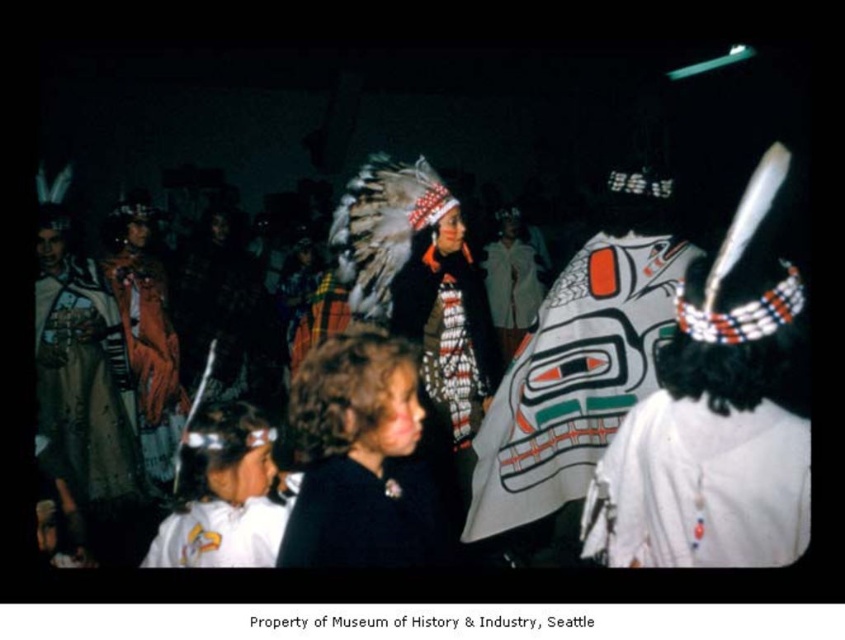
You are an attendee at the event and want to take a photo of both the dark brown hair at center and the white matte headdress at lower left. Which object should you focus on first if you want to capture both in the same frame without moving your camera?

The dark brown hair at center is larger in size than the white matte headdress at lower left, so you should focus on the dark brown hair at center first to ensure it fits properly in the frame before adjusting for the smaller white matte headdress at lower left.

You are standing in the middle of the event and want to move towards the two points marked in the image. Which point, point (604, 460) or point (390, 529), is closer to you?

Point (604, 460) is closer to you because it is further to the viewer than point (390, 529).